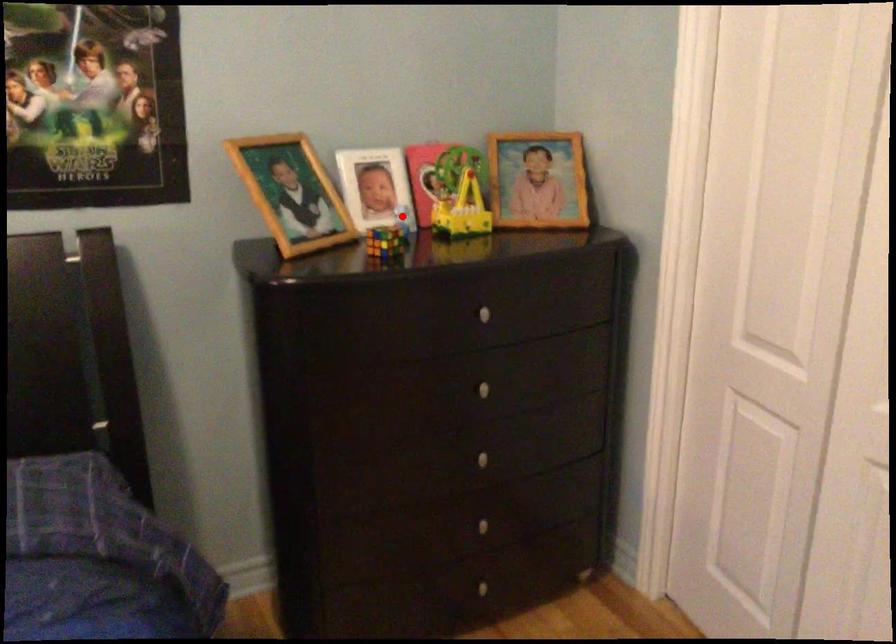
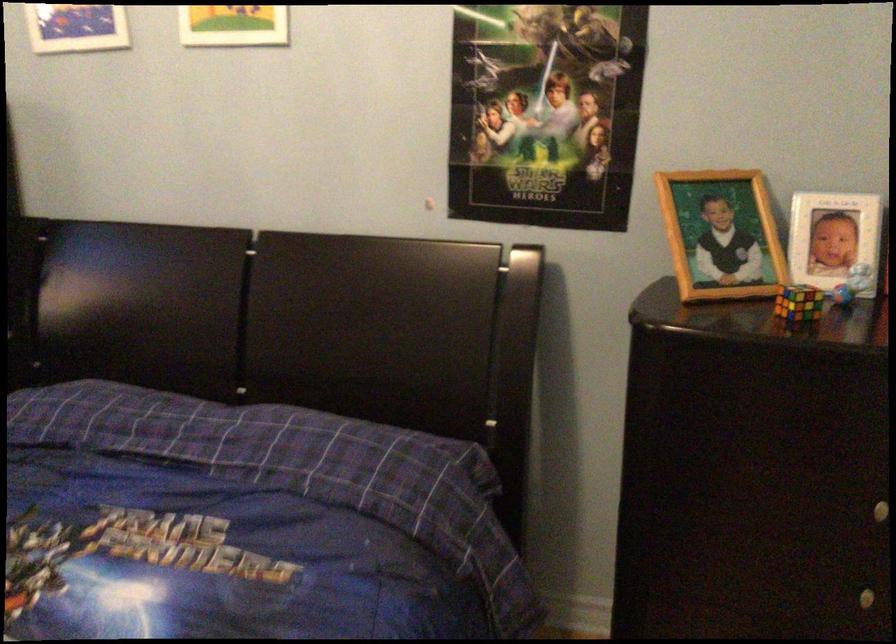
Locate, in the second image, the point that corresponds to the highlighted location in the first image.

(851, 283)